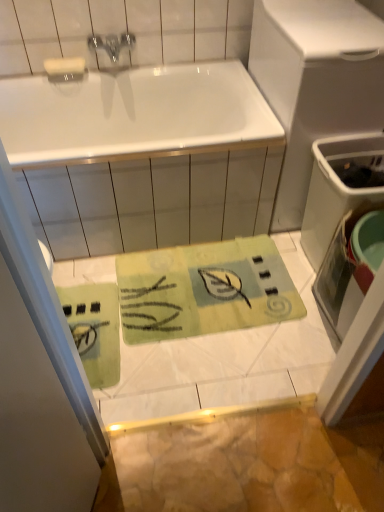
What do you see at coordinates (112, 44) in the screenshot? This screenshot has height=512, width=384. I see `metallic faucet at upper center` at bounding box center [112, 44].

This screenshot has height=512, width=384. I want to click on metallic faucet at upper center, so click(112, 44).

What do you see at coordinates (40, 379) in the screenshot?
I see `green fabric mat at upper center` at bounding box center [40, 379].

Image resolution: width=384 pixels, height=512 pixels. Identify the location of green fabric mat at upper center. (40, 379).

Image resolution: width=384 pixels, height=512 pixels. I want to click on metallic faucet at upper center, so (112, 44).

From a real-world perspective, is white plastic trash can at right on top of green fabric mat at upper center?

Actually, white plastic trash can at right is physically below green fabric mat at upper center in the real world.

From the picture: Is white plastic trash can at right not close to green fabric mat at upper center?

Indeed, white plastic trash can at right is not near green fabric mat at upper center.

Is white plastic trash can at right to the left or to the right of green fabric mat at upper center in the image?

Clearly, white plastic trash can at right is on the right of green fabric mat at upper center in the image.

Is white plastic trash can at right outside of green fabric mat at upper center?

white plastic trash can at right is positioned outside green fabric mat at upper center.

Can you see metallic faucet at upper center touching white matte bar of soap at upper left?

They are not placed beside each other.

Is metallic faucet at upper center taller or shorter than white matte bar of soap at upper left?

Considering their sizes, metallic faucet at upper center has more height than white matte bar of soap at upper left.

Between point (125, 46) and point (73, 67), which one is positioned in front?

Positioned in front is point (73, 67).

Considering the relative positions of metallic faucet at upper center and white matte bar of soap at upper left in the image provided, is metallic faucet at upper center to the right of white matte bar of soap at upper left from the viewer's perspective?

Yes, metallic faucet at upper center is to the right of white matte bar of soap at upper left.

From the image's perspective, is metallic faucet at upper center below white glossy bathtub at upper center?

No.

Considering their positions, is metallic faucet at upper center located in front of or behind white glossy bathtub at upper center?

In the image, metallic faucet at upper center appears behind white glossy bathtub at upper center.

Consider the image. Which of these two, metallic faucet at upper center or white glossy bathtub at upper center, is bigger?

white glossy bathtub at upper center.

Which point is more forward, (112, 34) or (239, 197)?

The point (239, 197) is closer to the camera.

From the picture: How many degrees apart are the facing directions of white glossy bathtub at upper center and white matte bar of soap at upper left?

The facing directions of white glossy bathtub at upper center and white matte bar of soap at upper left are 0.0427 degrees apart.

Considering the relative positions of white glossy bathtub at upper center and white matte bar of soap at upper left in the image provided, is white glossy bathtub at upper center to the right of white matte bar of soap at upper left from the viewer's perspective?

Yes.

In the image, there is a white matte bar of soap at upper left. At what (x,y) coordinates should I click in order to perform the action: click on bath below it (from a real-world perspective). Please return your answer as a coordinate pair (x, y). The width and height of the screenshot is (384, 512). Looking at the image, I should click on (143, 157).

Is white glossy bathtub at upper center smaller than white matte bar of soap at upper left?

No, white glossy bathtub at upper center is not smaller than white matte bar of soap at upper left.

How many degrees apart are the facing directions of white matte bar of soap at upper left and green fabric mat at upper center?

70.2 degrees.

Between white matte bar of soap at upper left and green fabric mat at upper center, which one has more height?

green fabric mat at upper center.

From a real-world perspective, is white matte bar of soap at upper left under green fabric mat at upper center?

Yes, from a real-world perspective, white matte bar of soap at upper left is beneath green fabric mat at upper center.

From a real-world perspective, relative to metallic faucet at upper center, is green fabric mat at upper center vertically above or below?

In terms of real-world spatial position, green fabric mat at upper center is below metallic faucet at upper center.

Which object is further away from the camera, green fabric mat at upper center or metallic faucet at upper center?

Positioned behind is metallic faucet at upper center.

Which object is positioned more to the left, green fabric mat at upper center or metallic faucet at upper center?

metallic faucet at upper center.

Is green fabric mat at upper center oriented towards metallic faucet at upper center?

No.

Considering the positions of objects green fabric mat at upper center and white glossy bathtub at upper center in the image provided, who is behind, green fabric mat at upper center or white glossy bathtub at upper center?

white glossy bathtub at upper center is more distant.

From the image's perspective, between green fabric mat at upper center and white glossy bathtub at upper center, which one is located above?

white glossy bathtub at upper center is shown above in the image.

Is there a large distance between green fabric mat at upper center and white glossy bathtub at upper center?

Absolutely, green fabric mat at upper center is distant from white glossy bathtub at upper center.

From the picture: Which point is more forward, (85, 509) or (97, 151)?

Point (85, 509)

At what (x,y) coordinates should I click in order to perform the action: click on shower door lying on the left of white plastic trash can at right. Please return your answer as a coordinate pair (x, y). The image size is (384, 512). Looking at the image, I should click on (40, 379).

Locate an element on the screen. This screenshot has width=384, height=512. tap above the white matte bar of soap at upper left (from the image's perspective) is located at coordinates (112, 44).

When comparing their distances from white matte bar of soap at upper left, does white glossy bathtub at upper center or green fabric mat at upper center seem closer?

Based on the image, white glossy bathtub at upper center appears to be nearer to white matte bar of soap at upper left.

Looking at the image, which one is located further to white glossy bathtub at upper center, white plastic trash can at right or metallic faucet at upper center?

metallic faucet at upper center lies further to white glossy bathtub at upper center than the other object.

Looking at the image, which one is located further to metallic faucet at upper center, white plastic trash can at right or green fabric mat at upper center?

green fabric mat at upper center lies further to metallic faucet at upper center than the other object.

Considering their positions, is white matte bar of soap at upper left positioned further to white plastic trash can at right than metallic faucet at upper center?

white matte bar of soap at upper left is positioned further to the anchor white plastic trash can at right.

Which object lies nearer to the anchor point white matte bar of soap at upper left, metallic faucet at upper center or white glossy bathtub at upper center?

Based on the image, metallic faucet at upper center appears to be nearer to white matte bar of soap at upper left.

From the image, which object appears to be nearer to white glossy bathtub at upper center, green fabric mat at upper center or white plastic trash can at right?

Among the two, white plastic trash can at right is located nearer to white glossy bathtub at upper center.

Based on their spatial positions, is metallic faucet at upper center or white matte bar of soap at upper left closer to green fabric mat at upper center?

Among the two, white matte bar of soap at upper left is located nearer to green fabric mat at upper center.

Based on their spatial positions, is white glossy bathtub at upper center or green fabric mat at upper center closer to metallic faucet at upper center?

white glossy bathtub at upper center is closer to metallic faucet at upper center.

The width and height of the screenshot is (384, 512). Find the location of `bath located between green fabric mat at upper center and white matte bar of soap at upper left in the depth direction`. bath located between green fabric mat at upper center and white matte bar of soap at upper left in the depth direction is located at coordinates (143, 157).

Where is `bath between green fabric mat at upper center and metallic faucet at upper center along the z-axis`? The image size is (384, 512). bath between green fabric mat at upper center and metallic faucet at upper center along the z-axis is located at coordinates (143, 157).

Where is `soap between metallic faucet at upper center and white glossy bathtub at upper center in the up-down direction`? This screenshot has height=512, width=384. soap between metallic faucet at upper center and white glossy bathtub at upper center in the up-down direction is located at coordinates (64, 66).

The height and width of the screenshot is (512, 384). I want to click on tap located between white matte bar of soap at upper left and white plastic trash can at right in the left-right direction, so click(x=112, y=44).